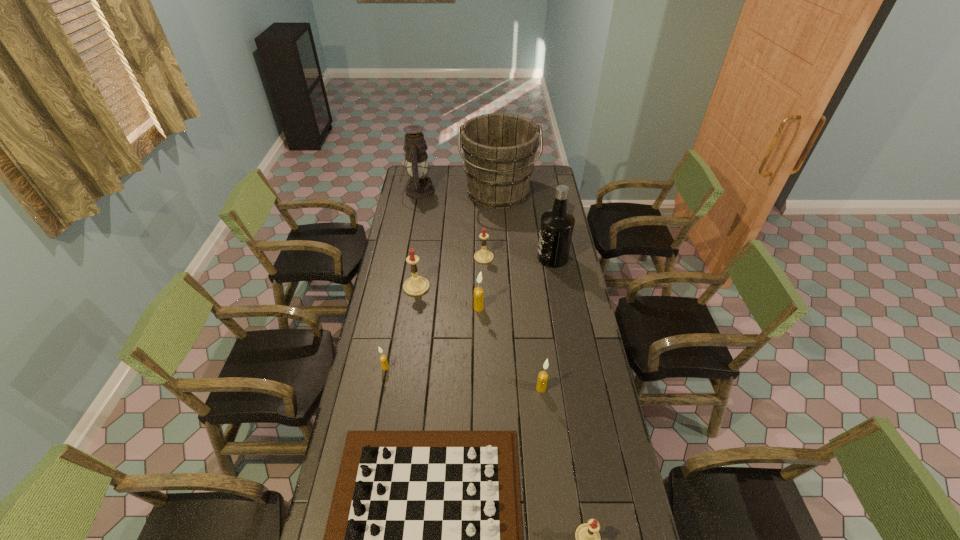
You are a GUI agent. You are given a task and a screenshot of the screen. Output one action in this format:
    pyautogui.click(x=<x>, y=<y>)
    Task: Click on the second nearest candle
    The height and width of the screenshot is (540, 960).
    Given the screenshot: What is the action you would take?
    click(543, 376)

The image size is (960, 540). I want to click on the smallest cream candle, so click(x=383, y=358).

Find the location of a particular element. Image resolution: width=960 pixels, height=540 pixels. the second farthest cream candle is located at coordinates (383, 358).

At what (x,y) coordinates should I click in order to perform the action: click on free space located on the handle side of the bucket. Please return your answer as a coordinate pair (x, y). This screenshot has width=960, height=540. Looking at the image, I should click on (502, 260).

What are the coordinates of `free space located on the right of the oil lamp` in the screenshot? It's located at (472, 191).

I want to click on vacant space located on the front label of the black liquor, so click(x=464, y=258).

In order to click on vacant space located on the front label of the black liquor in this screenshot , I will do `click(482, 258)`.

Identify the location of free space located on the front label of the black liquor. This screenshot has width=960, height=540. (506, 258).

The height and width of the screenshot is (540, 960). In order to click on vacant point located on the front of the farthest cream candle in this screenshot , I will do `click(479, 328)`.

This screenshot has width=960, height=540. Find the location of `vacant space located on the right of the second candle from left to right`. vacant space located on the right of the second candle from left to right is located at coordinates (480, 287).